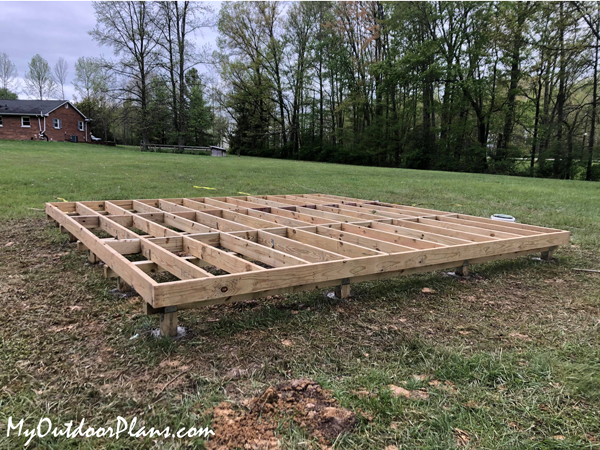
You are a GUI agent. You are given a task and a screenshot of the screen. Output one action in this format:
    pyautogui.click(x=<x>, y=<y>)
    Task: Click on the brown plywood beams
    
    Given the screenshot: What is the action you would take?
    pyautogui.click(x=384, y=263), pyautogui.click(x=128, y=271)